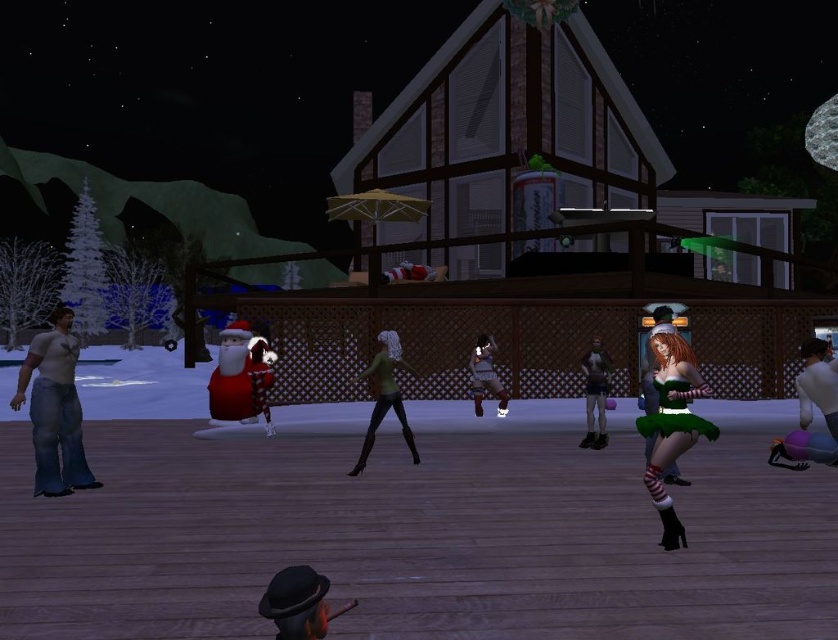
You are standing at the point with coordinates point (58, 422) and want to move to the point with coordinates point (830, 396). Which direction should you face to walk towards your destination?

You should face north because point (58, 422) is in front of point (830, 396), meaning it is closer to you. To reach the destination, you need to move away from your current position towards the north direction.

You are a photographer taking a picture of the jeans at left and the green satin dress at right. Which one will be in the foreground of the photo?

The jeans at left will be in the foreground because it is located above the green satin dress at right, which is further away from the camera.